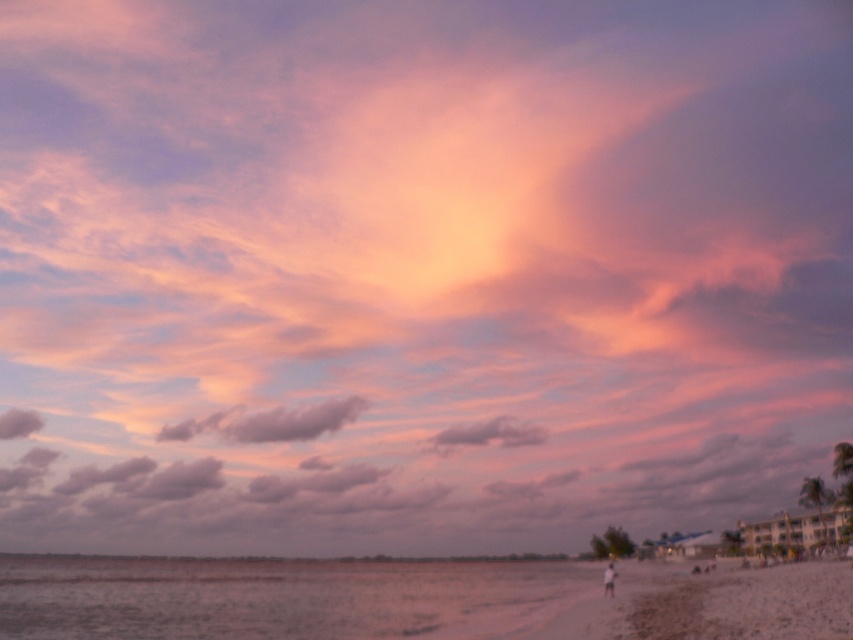
You are a photographer trying to capture the sunset on the beach. You notice the white sandy beach at lower right and the gray cotton cloud at upper left. Which object in the scene is bigger?

The white sandy beach at lower right is larger in size than the gray cotton cloud at upper left, so the white sandy beach at lower right is bigger.

You are standing on the beach and want to take a photo of the purple cotton cloud at center. Where should you look to capture it in your camera?

The purple cotton cloud at center is located at point (270, 422), so you should aim your camera towards that coordinate to capture it.